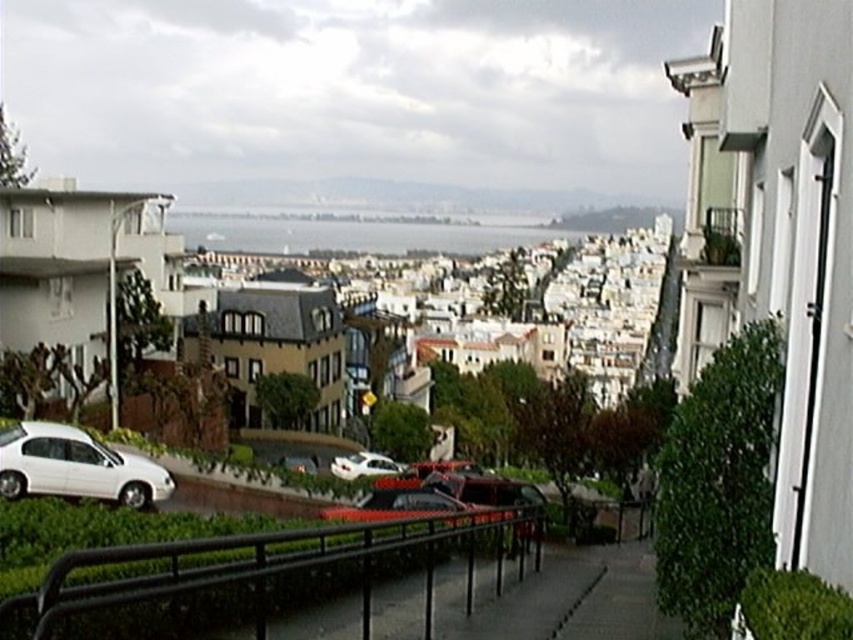
You are a drone operator trying to capture aerial footage of the white matte building at center and the shiny silver car at center. Since the drone has a limited battery, you want to prioritize filming the taller object first. Which object should you film first?

The white matte building at center is much taller than the shiny silver car at center, so you should film the white matte building at center first.

You are standing at the viewpoint overlooking the hilly urban landscape in San Francisco. There are two points marked on the image, one at coordinates point (170, 481) and the other at point (286, 460). Which point would you see first if you were to walk straight ahead towards the scene?

Point (170, 481) is closer to the camera than point (286, 460), so you would see point (170, 481) first as it is nearer to your current position.

You are a delivery driver needing to park your truck, which is 2 meters wide, in this area. Can you fit your truck between the white matte car at lower left and the shiny silver car at center?

The white matte car at lower left might be wider than the shiny silver car at center, so the space between them may not be sufficient for your 2 meter wide truck. Check the actual width before attempting to park.